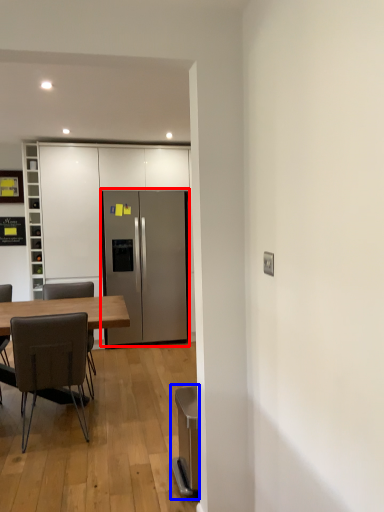
Question: Among these objects, which one is farthest to the camera, refrigerator (highlighted by a red box) or appliance (highlighted by a blue box)?

Choices:
 (A) refrigerator
 (B) appliance

Answer: (A)